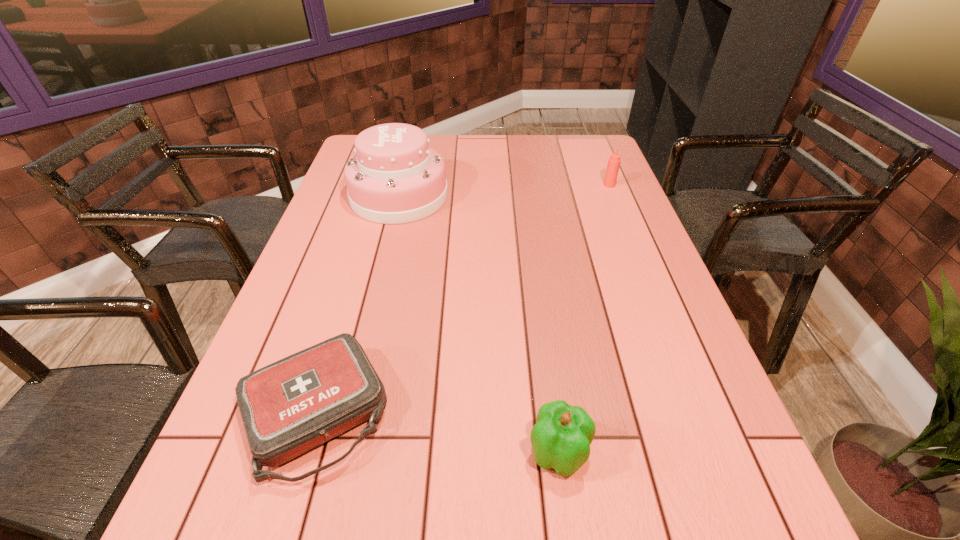
Image resolution: width=960 pixels, height=540 pixels. Identify the location of object positioned at the right edge. (614, 161).

Identify the location of vacant space at the far edge of the desktop. This screenshot has height=540, width=960. (452, 135).

At what (x,y) coordinates should I click in order to perform the action: click on vacant space at the near edge of the desktop. Please return your answer as a coordinate pair (x, y). Looking at the image, I should click on (637, 535).

What are the coordinates of `vacant space at the left edge of the desktop` in the screenshot? It's located at (x=339, y=186).

The width and height of the screenshot is (960, 540). In the image, there is a desktop. In order to click on vacant region at the right edge in this screenshot , I will do `click(601, 232)`.

Image resolution: width=960 pixels, height=540 pixels. In order to click on vacant space at the far right corner of the desktop in this screenshot , I will do `click(568, 141)`.

Where is `vacant area that lies between the shortest object and the rightmost object`? This screenshot has width=960, height=540. vacant area that lies between the shortest object and the rightmost object is located at coordinates (463, 299).

Where is `free spot between the tallest object and the third object from left to right`? The height and width of the screenshot is (540, 960). free spot between the tallest object and the third object from left to right is located at coordinates tap(479, 325).

The height and width of the screenshot is (540, 960). I want to click on unoccupied position between the Tabasco sauce and the tallest object, so click(504, 191).

Locate an element on the screen. Image resolution: width=960 pixels, height=540 pixels. free space between the Tabasco sauce and the bell pepper is located at coordinates (584, 319).